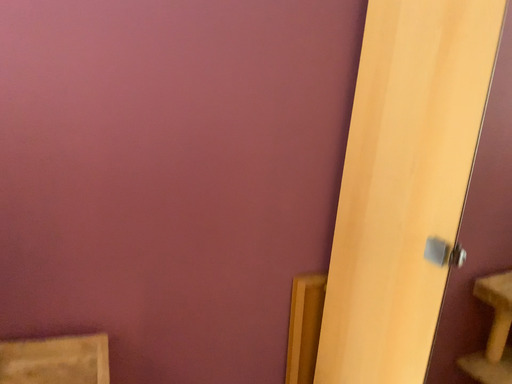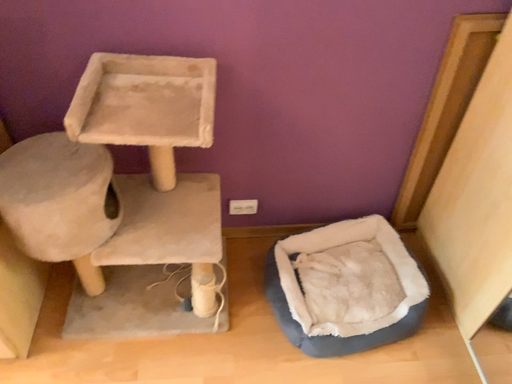
Question: How did the camera likely rotate when shooting the video?

Choices:
 (A) rotated right
 (B) rotated left

Answer: (B)